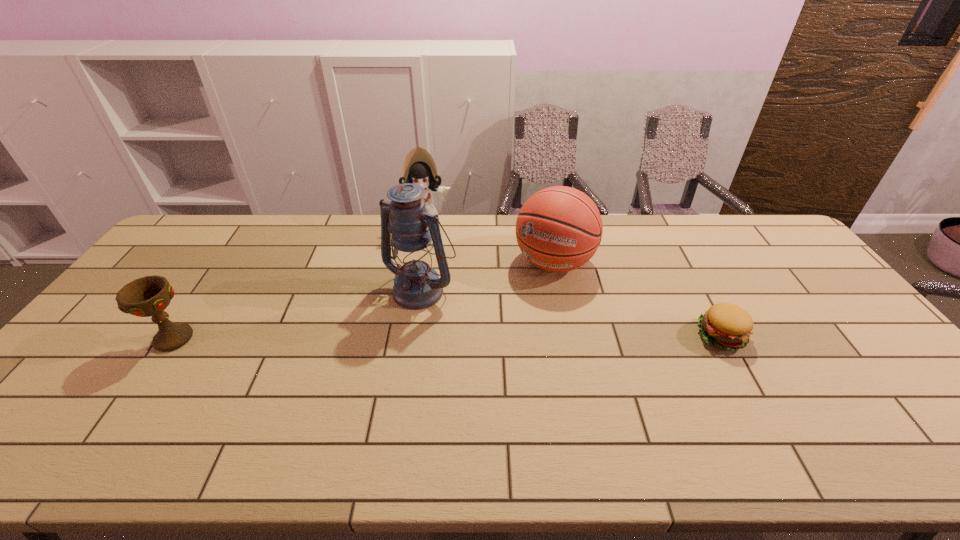
You are a GUI agent. You are given a task and a screenshot of the screen. Output one action in this format:
    pyautogui.click(x=<x>, y=<y>)
    Task: Click on the blank space located on the logo side of the second object from right to left
    This screenshot has width=960, height=540.
    Given the screenshot: What is the action you would take?
    pyautogui.click(x=531, y=299)

Locate an element on the screen. The image size is (960, 540). free space located on the logo side of the second object from right to left is located at coordinates (482, 373).

At what (x,y) coordinates should I click in order to perform the action: click on free location located on the front-facing side of the lantern. Please return your answer as a coordinate pair (x, y). This screenshot has width=960, height=540. Looking at the image, I should click on (372, 340).

Where is `free location located on the front-facing side of the lantern`? The height and width of the screenshot is (540, 960). free location located on the front-facing side of the lantern is located at coordinates (360, 353).

At what (x,y) coordinates should I click in order to perform the action: click on free region located on the front-facing side of the lantern. Please return your answer as a coordinate pair (x, y). Looking at the image, I should click on tap(326, 391).

Locate an element on the screen. The width and height of the screenshot is (960, 540). vacant region located 0.370m at the front face of the farthest object is located at coordinates (427, 310).

Where is `free region located 0.140m at the front face of the farthest object`? The image size is (960, 540). free region located 0.140m at the front face of the farthest object is located at coordinates (426, 261).

At what (x,y) coordinates should I click in order to perform the action: click on free space located at the front face of the farthest object. Please return your answer as a coordinate pair (x, y). The height and width of the screenshot is (540, 960). Looking at the image, I should click on (427, 306).

Find the location of a particular element. The image size is (960, 540). basketball positioned at the far edge is located at coordinates (558, 229).

Where is `doll present at the far edge`? This screenshot has width=960, height=540. doll present at the far edge is located at coordinates (x=419, y=167).